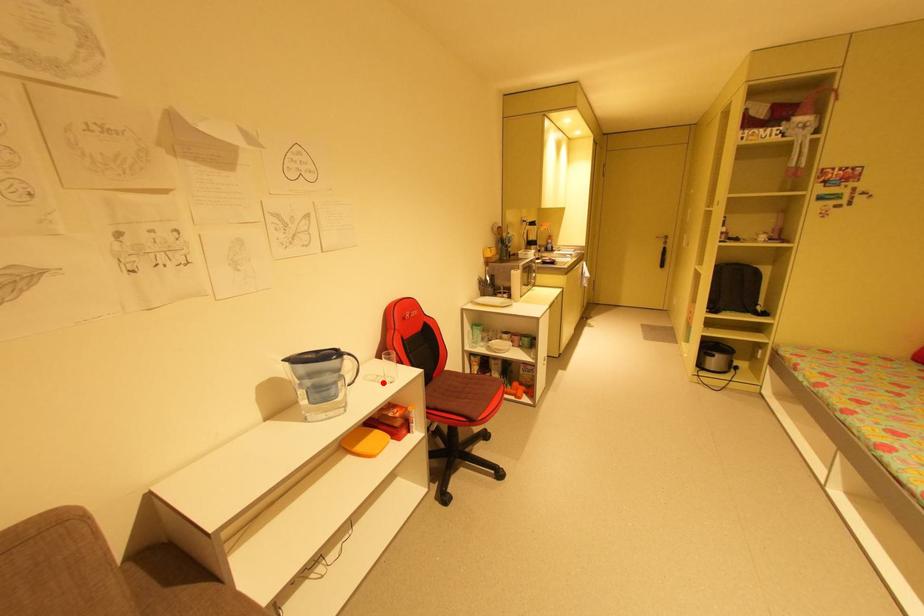
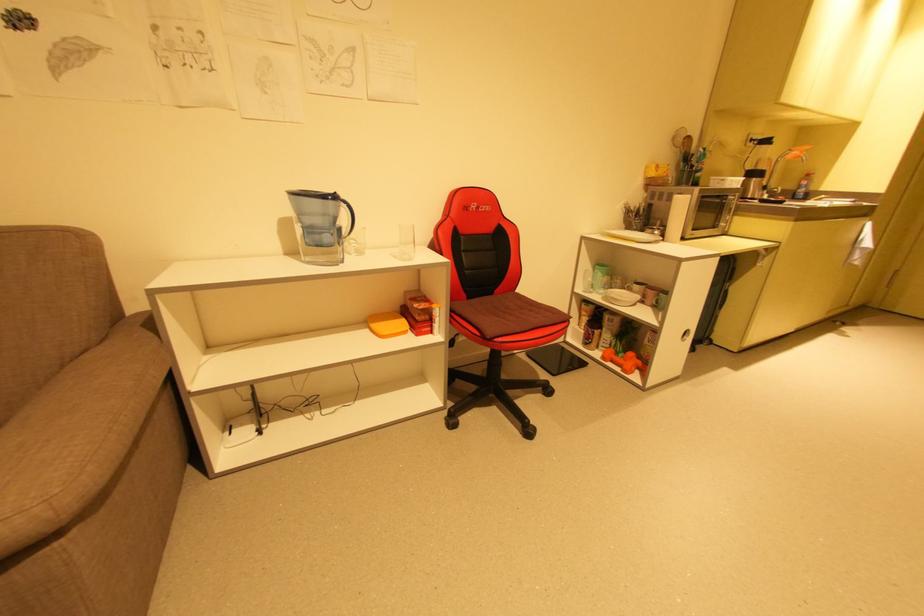
The point at the highlighted location is marked in the first image. Where is the corresponding point in the second image?

(400, 257)